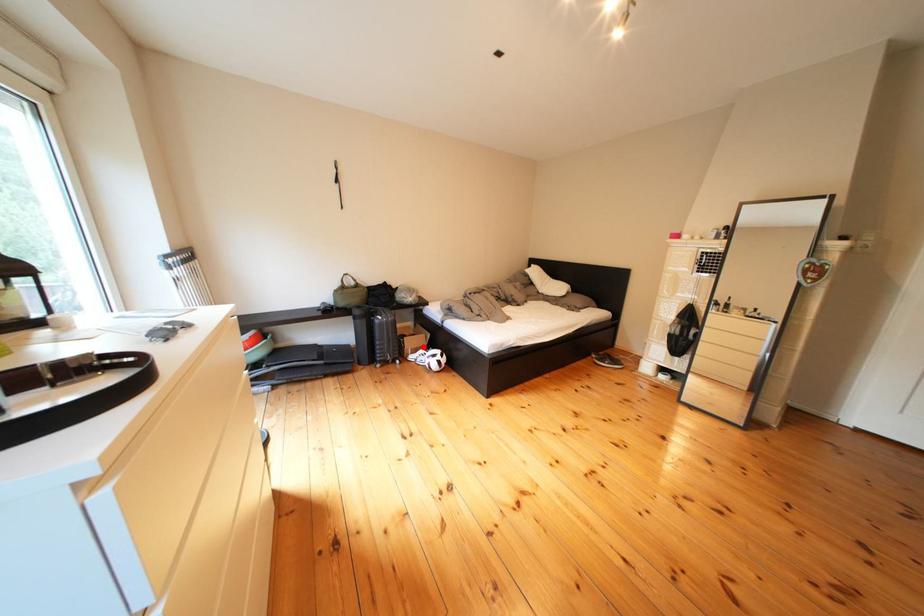
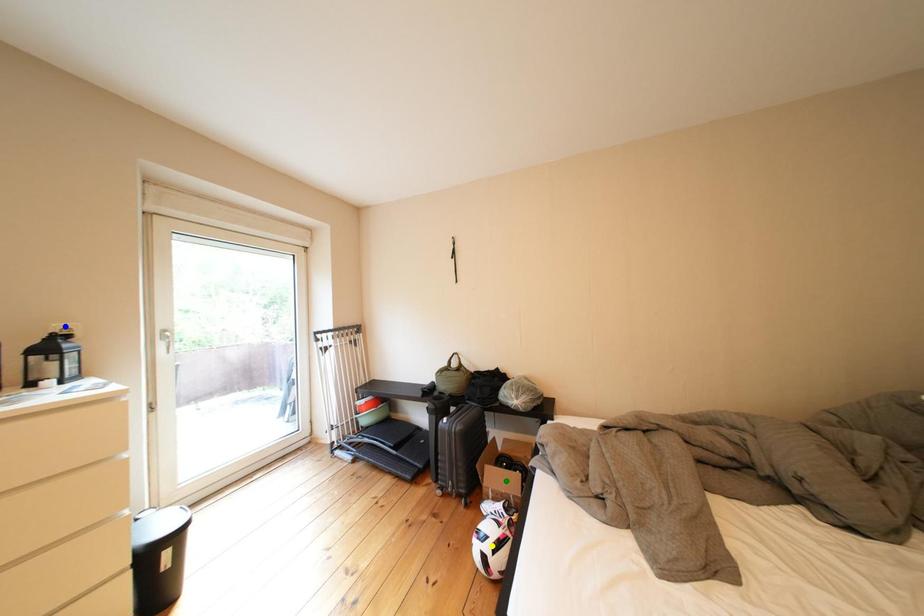
Question: I am providing you with two images of the same scene from different viewpoints. A red point is marked on the first image. You are given multiple points on the second image. Which spot in image 2 lines up with the point in image 1?

Choices:
 (A) yellow point
 (B) green point
 (C) blue point

Answer: (B)